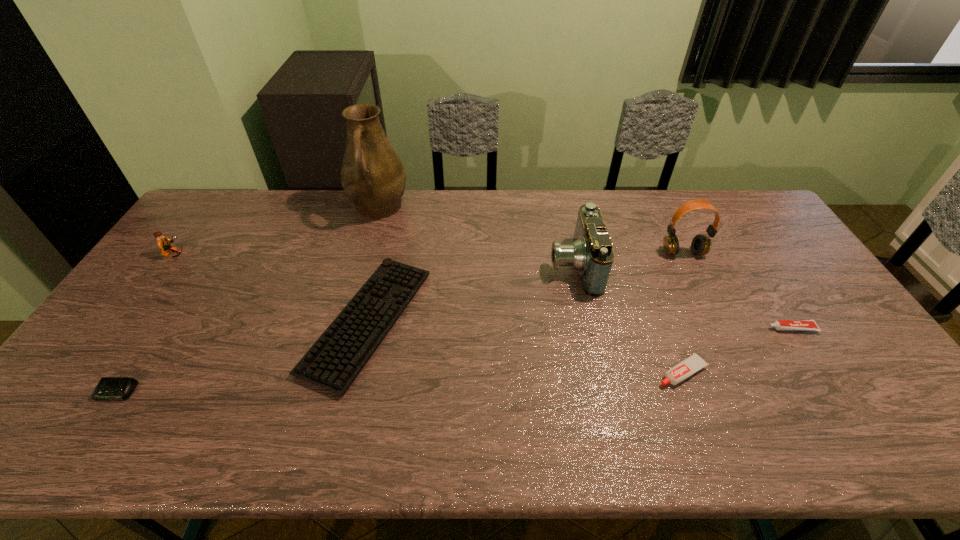
This screenshot has width=960, height=540. What are the coordinates of `free location at the left edge` in the screenshot? It's located at (153, 292).

The height and width of the screenshot is (540, 960). Find the location of `free point at the right edge`. free point at the right edge is located at coordinates (827, 329).

Locate an element on the screen. vacant space at the far left corner is located at coordinates point(208,215).

In the image, there is a desktop. Where is `free space at the near right corner`? The height and width of the screenshot is (540, 960). free space at the near right corner is located at coordinates (900, 423).

Find the location of a particular element. The image size is (960, 540). free point between the left toothpaste and the alarm clock is located at coordinates (398, 382).

What are the coordinates of `unoccupied position between the fourth tallest object and the farthest object` in the screenshot? It's located at (276, 232).

Find the location of a particular element. unoccupied area between the leftmost object and the pitcher is located at coordinates (276, 232).

Where is `vacant region between the tallest object and the alarm clock`? The height and width of the screenshot is (540, 960). vacant region between the tallest object and the alarm clock is located at coordinates (248, 300).

The image size is (960, 540). Find the location of `empty space that is in between the computer keyboard and the third object from right to left`. empty space that is in between the computer keyboard and the third object from right to left is located at coordinates (525, 347).

Where is `vacant area that lies between the second object from right to left and the Lego`? vacant area that lies between the second object from right to left and the Lego is located at coordinates (429, 254).